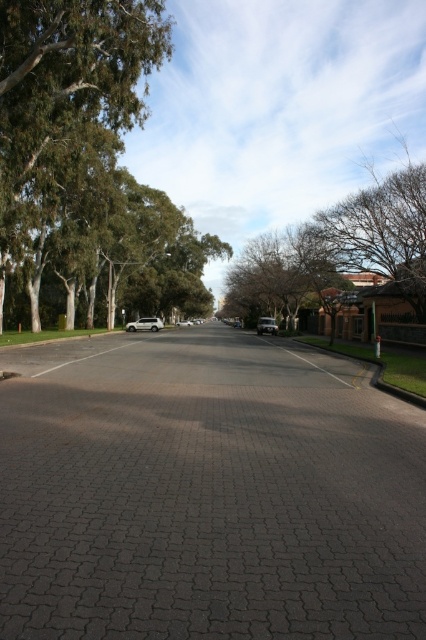
Question: Among these objects, which one is farthest from the camera?

Choices:
 (A) metallic silver sedan at center
 (B) green leafy tree at upper left

Answer: (A)

Question: Which point appears farthest from the camera in this image?

Choices:
 (A) (233, 323)
 (B) (183, 323)

Answer: (A)

Question: Does silver metallic suv at center appear under white matte car at center?

Choices:
 (A) yes
 (B) no

Answer: (A)

Question: Does white painted line at center have a lesser width compared to silver metallic suv at center?

Choices:
 (A) yes
 (B) no

Answer: (A)

Question: Which of the following is the farthest from the observer?

Choices:
 (A) white painted line at center
 (B) silver metallic suv at center

Answer: (B)

Question: Can you confirm if brown leafy tree at upper right is wider than metallic silver sedan at center?

Choices:
 (A) no
 (B) yes

Answer: (B)